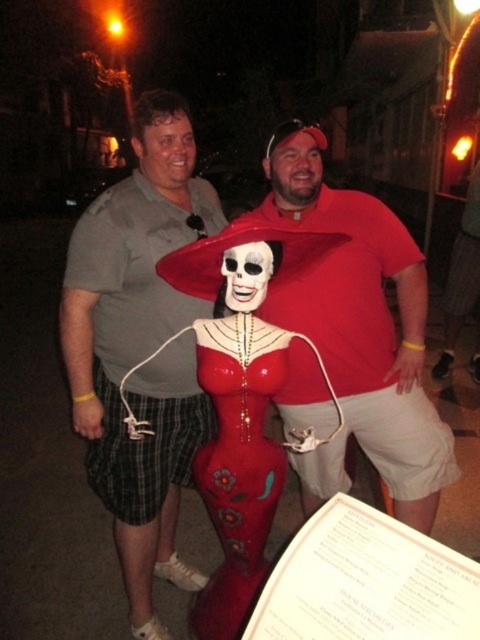
Who is positioned more to the left, gray cotton shirt at center or matte red dress at center?

gray cotton shirt at center is more to the left.

Does point (127, 468) lie behind point (265, 381)?

Yes, point (127, 468) is behind point (265, 381).

The image size is (480, 640). I want to click on gray cotton shirt at center, so click(x=141, y=348).

Based on the photo, is glossy plastic statue at center to the left of matte red dress at center from the viewer's perspective?

No, glossy plastic statue at center is not to the left of matte red dress at center.

Between glossy plastic statue at center and matte red dress at center, which one has more height?

glossy plastic statue at center is taller.

Locate an element on the screen. glossy plastic statue at center is located at coordinates (241, 400).

Locate an element on the screen. This screenshot has height=640, width=480. glossy plastic statue at center is located at coordinates (241, 400).

Can you confirm if matte plastic statue at center is positioned below gray cotton shirt at center?

Yes, matte plastic statue at center is below gray cotton shirt at center.

Locate an element on the screen. matte plastic statue at center is located at coordinates (360, 330).